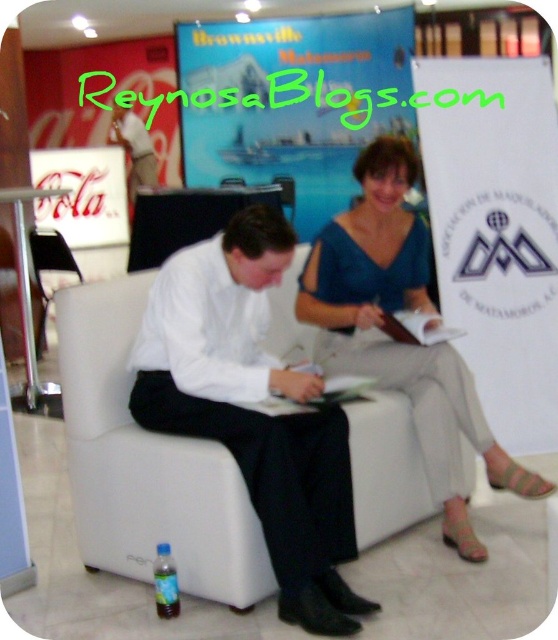
In the scene shown: Measure the distance between white smooth shirt at center and blue satin blouse at center.

23.24 inches

Locate an element on the screen. The width and height of the screenshot is (558, 640). white smooth shirt at center is located at coordinates (253, 410).

Image resolution: width=558 pixels, height=640 pixels. What are the coordinates of `white smooth shirt at center` in the screenshot? It's located at (253, 410).